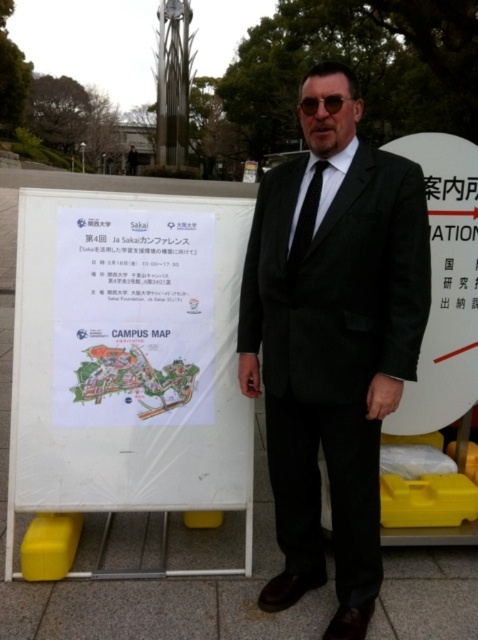
You are a photographer taking a picture of the signboard. You notice two points on the signboard at coordinates point (144, 333) and point (307, 225). Which point is closer to the camera?

Point (144, 333) is further to the camera than point (307, 225), so the point closer to the camera is point (307, 225).

You are a photographer taking a picture of the man standing in front of the white plastic signboard at center and the black silk tie at center. To ensure both are visible in the frame, should you adjust your camera to focus more on the left or the right side?

The white plastic signboard at center is to the left of the black silk tie at center, so you should focus more on the left side to capture both the white plastic signboard at center and the black silk tie at center in the frame.

You are a visitor at a campus and see the man in a dark suit standing in front of a white signboard. The signboard has a campus map with buildings and pathways. There is a specific point marked at coordinates (128,368) on the signboard. What object is located exactly at that point?

At point (128,368) lies the white plastic signboard at center.